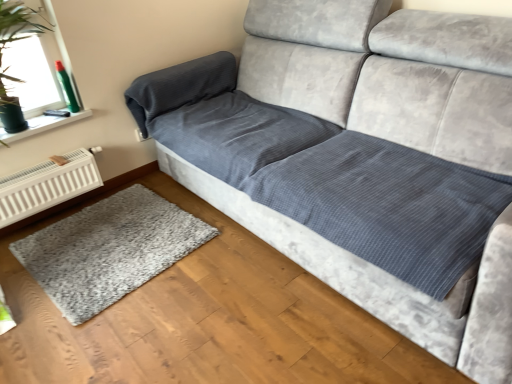
Question: Should I look upward or downward to see gray shaggy rug at lower left?

Choices:
 (A) up
 (B) down

Answer: (B)

Question: Does gray shaggy rug at lower left have a greater height compared to transparent glass window at upper left?

Choices:
 (A) yes
 (B) no

Answer: (B)

Question: Considering the relative sizes of gray shaggy rug at lower left and transparent glass window at upper left in the image provided, is gray shaggy rug at lower left wider than transparent glass window at upper left?

Choices:
 (A) yes
 (B) no

Answer: (A)

Question: Could you tell me if gray shaggy rug at lower left is turned towards transparent glass window at upper left?

Choices:
 (A) yes
 (B) no

Answer: (B)

Question: From the image's perspective, is gray shaggy rug at lower left above transparent glass window at upper left?

Choices:
 (A) no
 (B) yes

Answer: (A)

Question: Considering the relative positions of gray shaggy rug at lower left and transparent glass window at upper left in the image provided, is gray shaggy rug at lower left in front of transparent glass window at upper left?

Choices:
 (A) no
 (B) yes

Answer: (B)

Question: Is gray shaggy rug at lower left shorter than transparent glass window at upper left?

Choices:
 (A) yes
 (B) no

Answer: (A)

Question: From a real-world perspective, does white metallic radiator at lower left sit lower than transparent glass window at upper left?

Choices:
 (A) no
 (B) yes

Answer: (B)

Question: Is white metallic radiator at lower left not close to transparent glass window at upper left?

Choices:
 (A) yes
 (B) no

Answer: (B)

Question: Is white metallic radiator at lower left to the right of transparent glass window at upper left from the viewer's perspective?

Choices:
 (A) yes
 (B) no

Answer: (A)

Question: Is white metallic radiator at lower left oriented towards transparent glass window at upper left?

Choices:
 (A) no
 (B) yes

Answer: (A)

Question: Considering the relative sizes of white metallic radiator at lower left and transparent glass window at upper left in the image provided, is white metallic radiator at lower left bigger than transparent glass window at upper left?

Choices:
 (A) yes
 (B) no

Answer: (B)

Question: Does white metallic radiator at lower left have a greater width compared to transparent glass window at upper left?

Choices:
 (A) no
 (B) yes

Answer: (A)

Question: Would you say transparent glass window at upper left contains white metallic radiator at lower left?

Choices:
 (A) no
 (B) yes

Answer: (A)